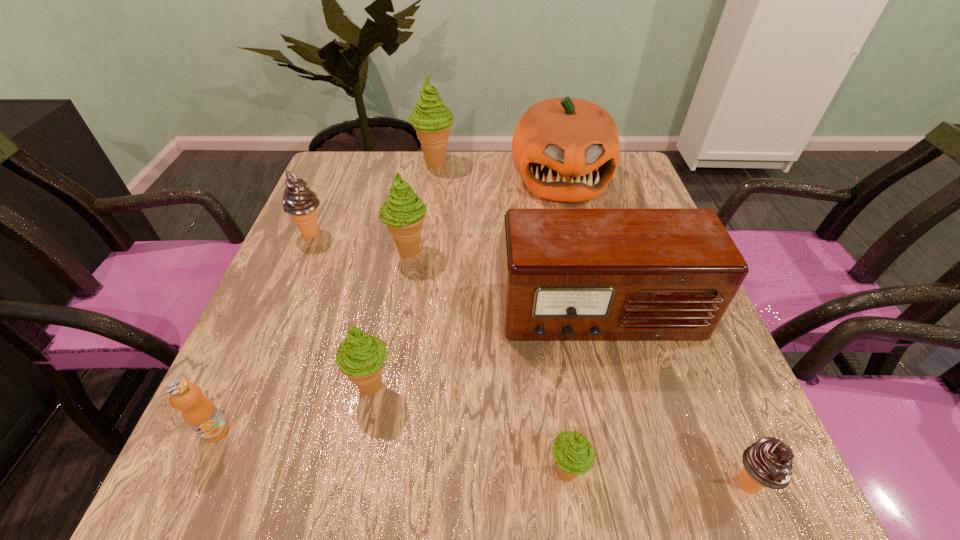
Where is `free space located 0.190m on the left of the third biggest green icecream`? free space located 0.190m on the left of the third biggest green icecream is located at coordinates (237, 386).

You are a GUI agent. You are given a task and a screenshot of the screen. Output one action in this format:
    pyautogui.click(x=<x>, y=<y>)
    Task: Click on the free space located 0.090m on the front label of the third nearest object
    
    Given the screenshot: What is the action you would take?
    pyautogui.click(x=182, y=505)

The height and width of the screenshot is (540, 960). In order to click on free region located on the left of the smallest green icecream in this screenshot , I will do `click(387, 472)`.

Locate an element on the screen. The width and height of the screenshot is (960, 540). vacant area situated 0.250m on the back of the nearer chocolate icecream is located at coordinates (684, 332).

Image resolution: width=960 pixels, height=540 pixels. Identify the location of icecream that is at the far edge. (431, 119).

Where is `pumpkin present at the far edge`? pumpkin present at the far edge is located at coordinates (566, 149).

The image size is (960, 540). I want to click on icecream present at the left edge, so click(301, 203).

At what (x,y) coordinates should I click in order to perform the action: click on orange juice positioned at the left edge. Please return your answer as a coordinate pair (x, y). Looking at the image, I should click on (199, 412).

Locate an element on the screen. The width and height of the screenshot is (960, 540). pumpkin located at the right edge is located at coordinates (566, 149).

This screenshot has height=540, width=960. I want to click on radio receiver that is at the right edge, so click(x=567, y=274).